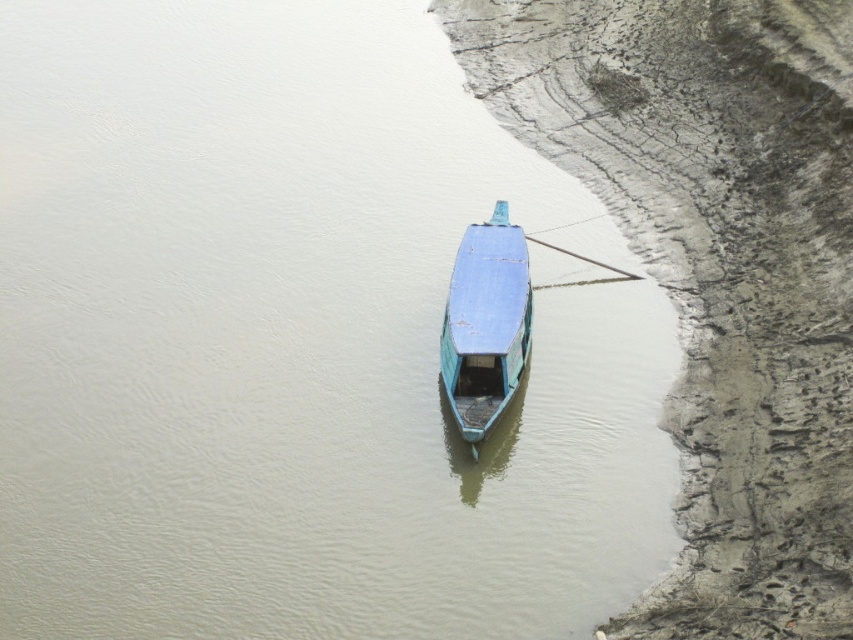
Looking at this image, you are a photographer planning to take a wide shot of the muddy dirt river bank at lower right and the blue matte boat at center. Based on their sizes, which object should you focus on first to ensure it is in frame?

The muddy dirt river bank at lower right is larger in size than the blue matte boat at center, so you should focus on the muddy dirt river bank at lower right first to ensure it is in frame.

You are standing at the camera position and want to reach the point marked at coordinates (700,132). The boat is between you and that point. Can you walk directly to the point without going around the boat?

The point marked at coordinates (700,132) is 189.62 feet away from the camera. Since the boat is between you and the point, you would need to go around the boat to reach it directly.